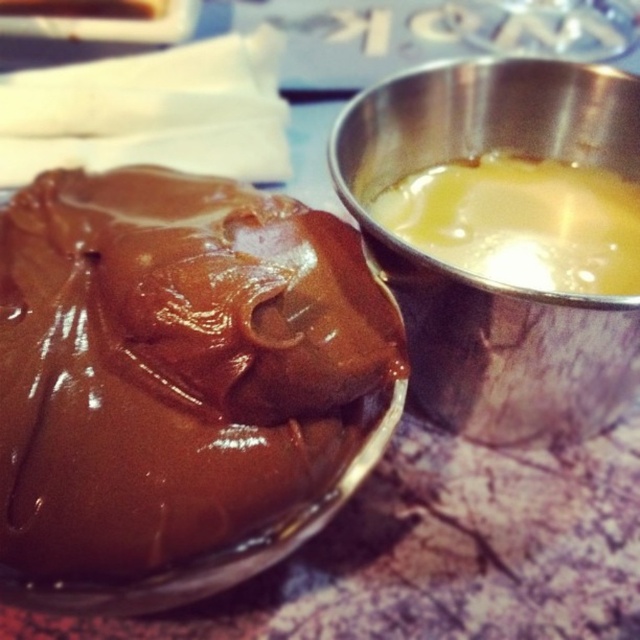
I want to click on shiny brown chocolate at left, so click(173, 364).

Can you confirm if shiny brown chocolate at left is positioned to the left of yellow translucent liquid at upper right?

Indeed, shiny brown chocolate at left is positioned on the left side of yellow translucent liquid at upper right.

Who is more distant from viewer, (64,480) or (502,218)?

Point (502,218)

Locate an element on the screen. This screenshot has height=640, width=640. shiny brown chocolate at left is located at coordinates (173, 364).

Consider the image. Who is positioned more to the left, shiny brown chocolate at left or metallic yellow liquid at upper right?

shiny brown chocolate at left is more to the left.

Does shiny brown chocolate at left have a lesser height compared to metallic yellow liquid at upper right?

Indeed, shiny brown chocolate at left has a lesser height compared to metallic yellow liquid at upper right.

The image size is (640, 640). I want to click on shiny brown chocolate at left, so click(x=173, y=364).

From the picture: Which is more to the left, metallic yellow liquid at upper right or yellow translucent liquid at upper right?

metallic yellow liquid at upper right

Locate an element on the screen. This screenshot has height=640, width=640. metallic yellow liquid at upper right is located at coordinates (476, 276).

Locate an element on the screen. Image resolution: width=640 pixels, height=640 pixels. metallic yellow liquid at upper right is located at coordinates (476, 276).